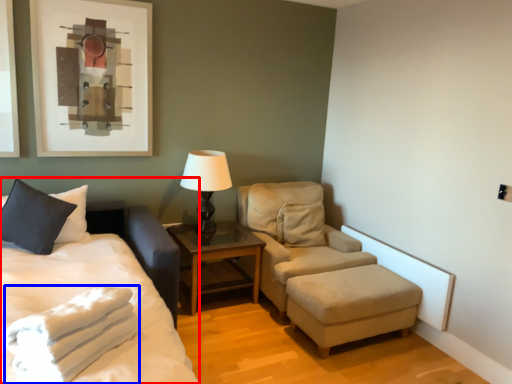
Question: Among these objects, which one is nearest to the camera, bed (highlighted by a red box) or blanket (highlighted by a blue box)?

Choices:
 (A) bed
 (B) blanket

Answer: (A)